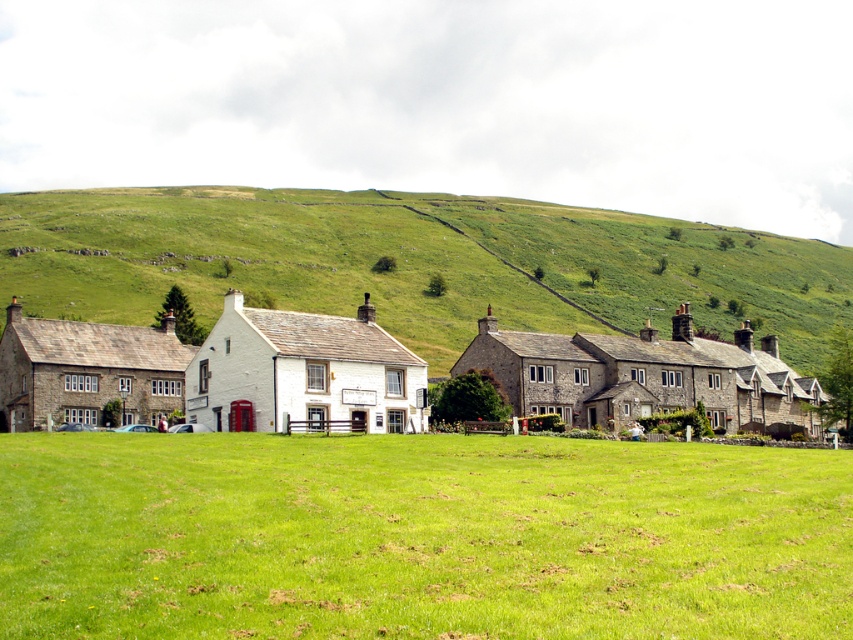
You are a landscape architect planning to install a new water feature in the field. The water feature requires a slope steeper than the hillside to function properly. Based on the scene, can you determine if the green grassy hillside at center is tall enough to create a sufficient slope for the water feature compared to the stone houses at center?

The green grassy hillside at center is much taller than the stone houses at center, so it should provide a sufficient slope for the water feature since it is significantly higher in elevation compared to the houses.

You are standing at the point marked by coordinates point (419, 538) in the image. Based on the scene description, what is the immediate surface you are standing on?

The point (419, 538) marks green grass at center, so you are standing on green grass.